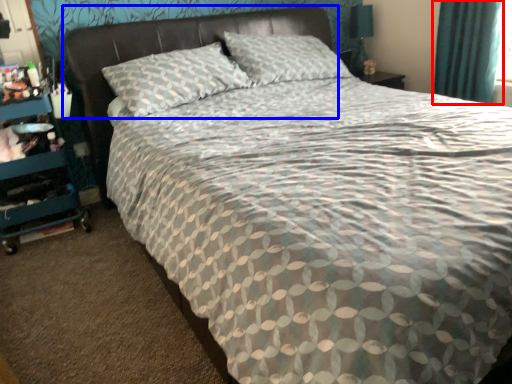
Question: Which of the following is the farthest to the observer, curtain (highlighted by a red box) or headboard (highlighted by a blue box)?

Choices:
 (A) curtain
 (B) headboard

Answer: (A)